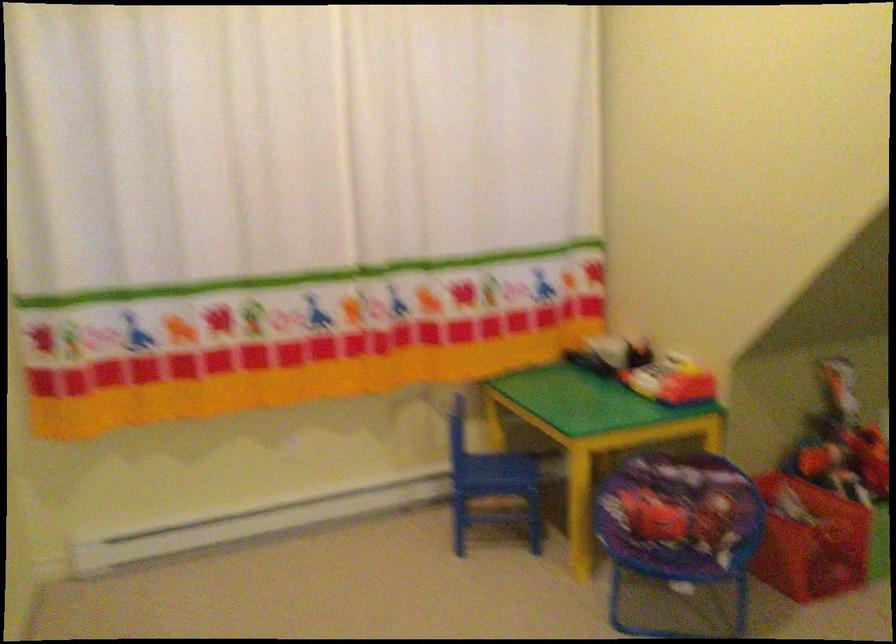
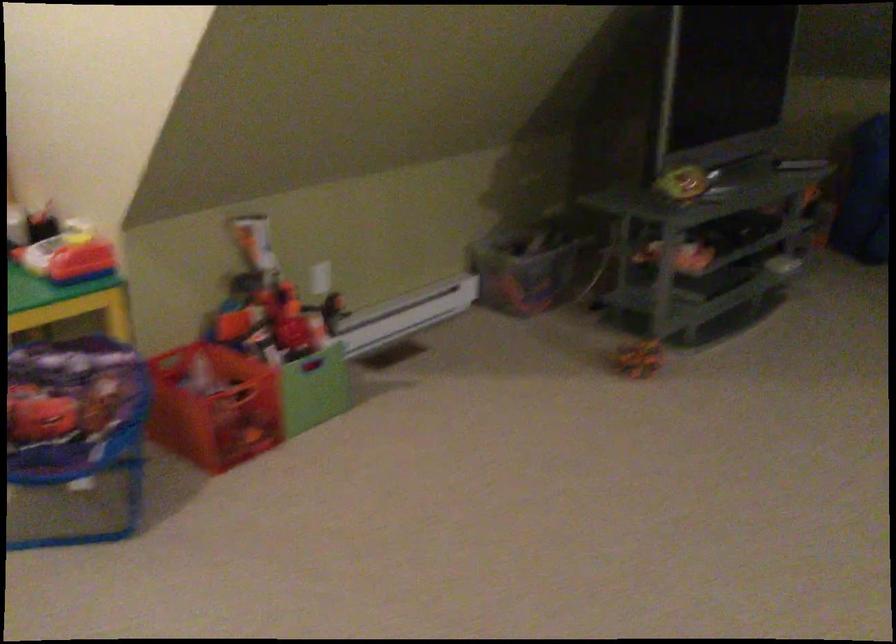
Question: How did the camera likely rotate?

Choices:
 (A) Left
 (B) Right
 (C) Up
 (D) Down

Answer: (B)